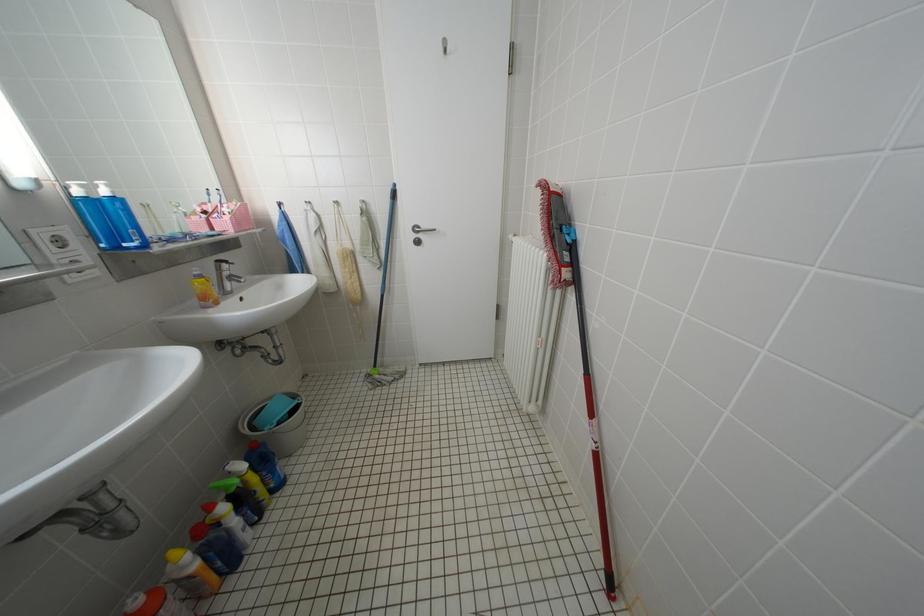
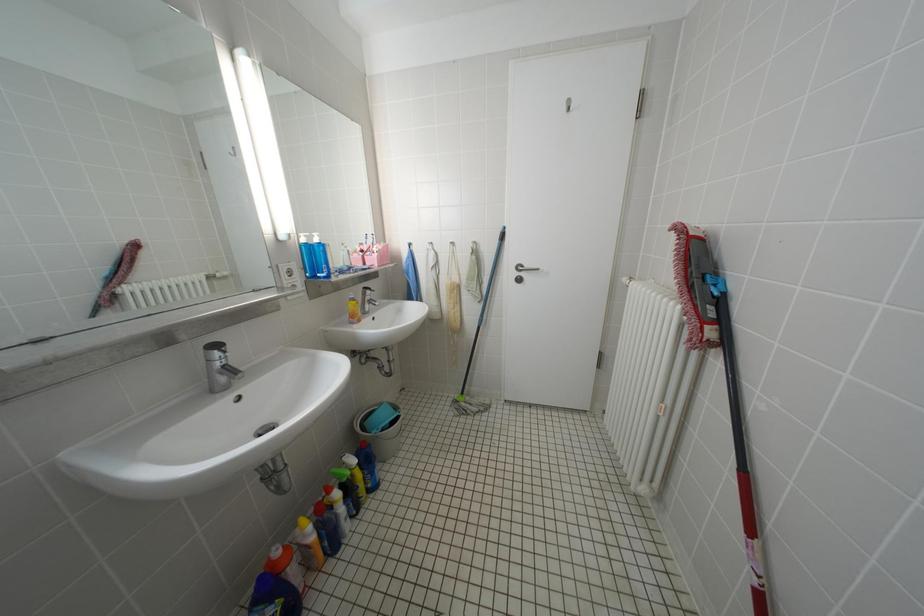
Question: The images are taken continuously from a first-person perspective. In which direction is your viewpoint rotating?

Choices:
 (A) Left
 (B) Right
 (C) Up
 (D) Down

Answer: (A)